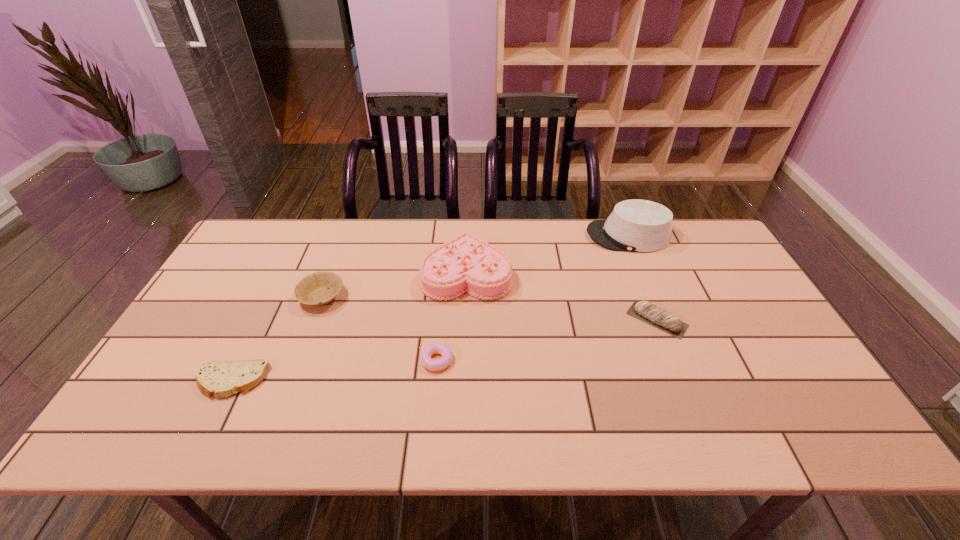
Locate an element on the screen. This screenshot has width=960, height=540. object that is at the far right corner is located at coordinates (635, 225).

Locate an element on the screen. The height and width of the screenshot is (540, 960). free location at the far edge is located at coordinates (328, 219).

In the image, there is a desktop. Where is `free space at the near edge`? free space at the near edge is located at coordinates (381, 441).

Find the location of a particular element. Image resolution: width=960 pixels, height=540 pixels. vacant point at the left edge is located at coordinates (261, 267).

This screenshot has height=540, width=960. In order to click on free space at the right edge in this screenshot , I will do `click(794, 375)`.

At what (x,y) coordinates should I click in order to perform the action: click on vacant space at the far left corner of the desktop. Please return your answer as a coordinate pair (x, y). Image resolution: width=960 pixels, height=540 pixels. Looking at the image, I should click on (282, 249).

This screenshot has width=960, height=540. Identify the location of vacant region at the far right corner of the desktop. (684, 238).

The height and width of the screenshot is (540, 960). I want to click on vacant space at the near right corner, so click(x=818, y=409).

Locate an element on the screen. The width and height of the screenshot is (960, 540). empty location between the farther pita bread and the doughnut is located at coordinates (547, 340).

You are a GUI agent. You are given a task and a screenshot of the screen. Output one action in this format:
    pyautogui.click(x=<x>, y=<y>)
    Task: Click on the free space between the bowl and the cake
    
    Given the screenshot: What is the action you would take?
    pyautogui.click(x=395, y=285)